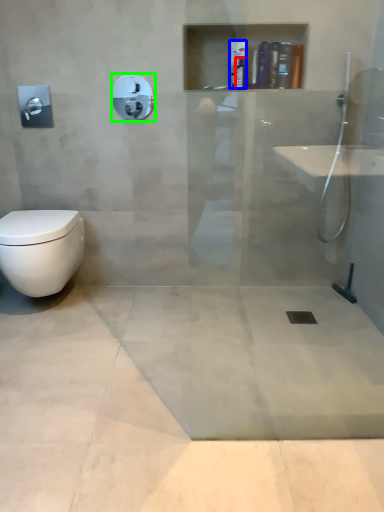
Question: Which object is positioned farthest from toiletry (highlighted by a red box)? Select from toiletry (highlighted by a blue box) and shower (highlighted by a green box).

Choices:
 (A) toiletry
 (B) shower

Answer: (B)